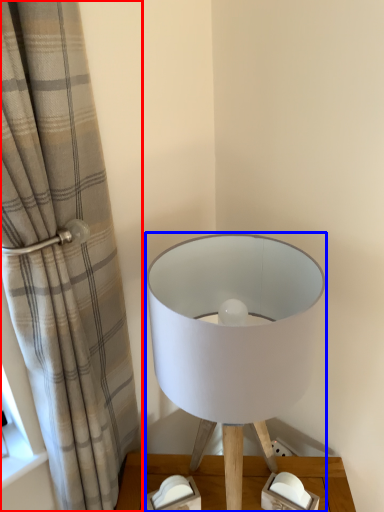
Question: Which of the following is the closest to the observer, curtain (highlighted by a red box) or lamp (highlighted by a blue box)?

Choices:
 (A) curtain
 (B) lamp

Answer: (A)